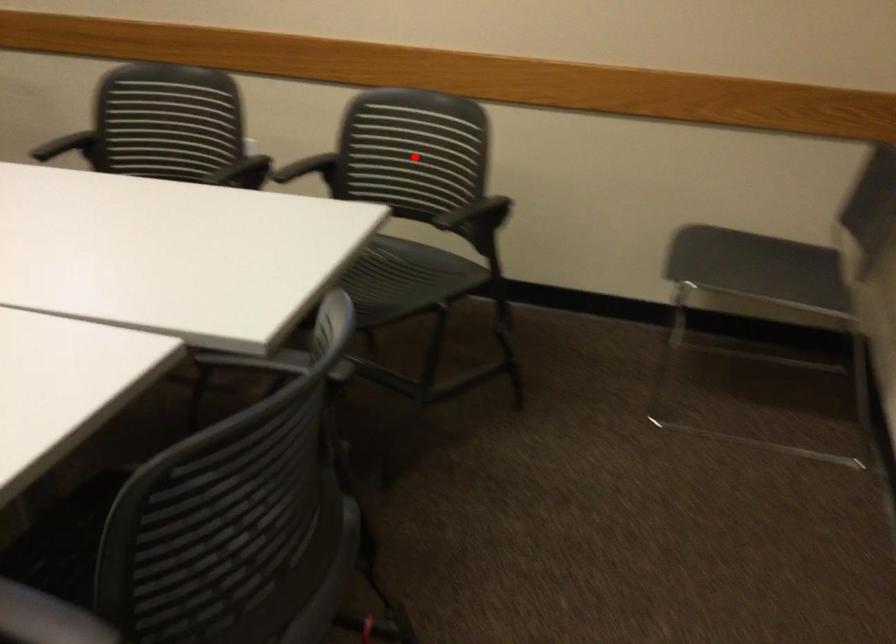
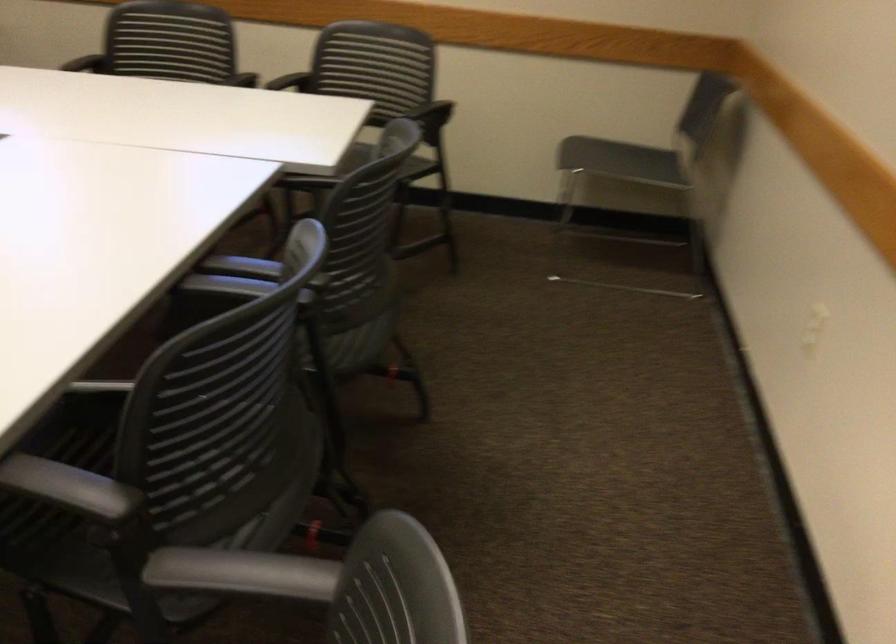
Locate, in the second image, the point that corresponds to the highlighted location in the first image.

(375, 73)